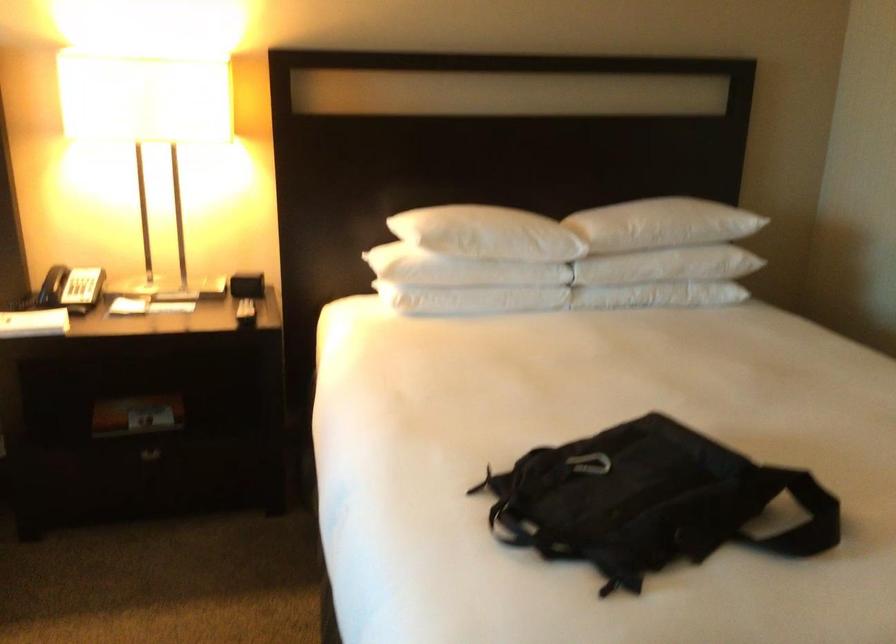
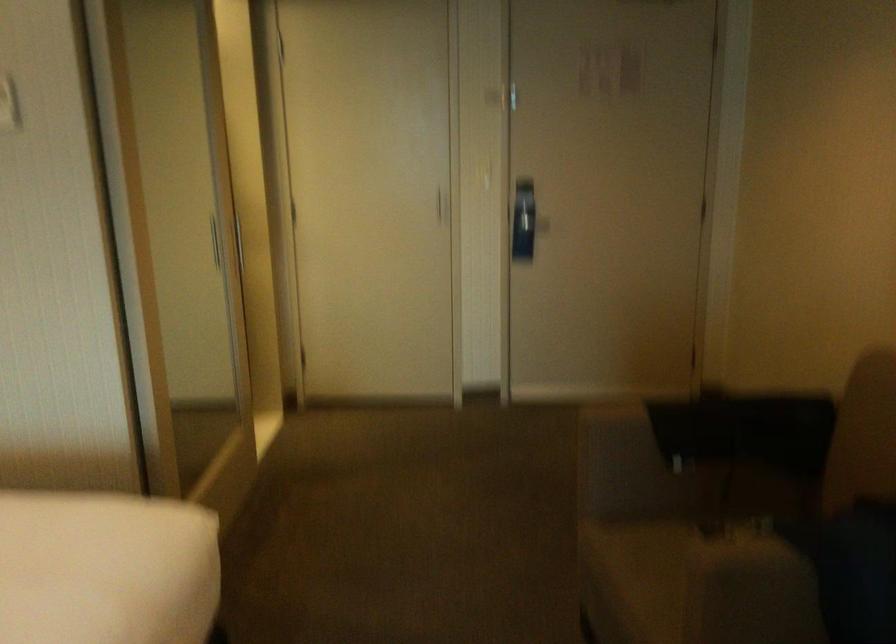
Question: The camera is either moving clockwise (left) or counter-clockwise (right) around the object. The first image is from the beginning of the video and the second image is from the end. Is the camera moving left or right when shooting the video?

Choices:
 (A) Left
 (B) Right

Answer: (A)